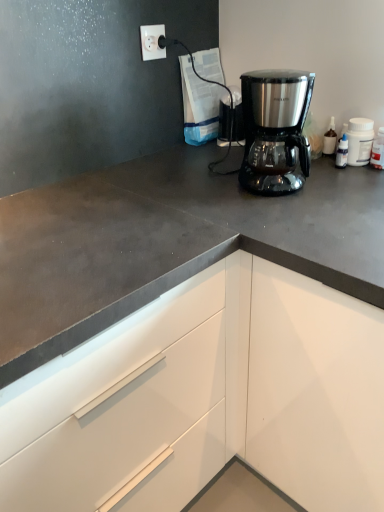
Question: Does white plastic socket at upper left have a larger size compared to stainless steel coffee maker at center?

Choices:
 (A) yes
 (B) no

Answer: (B)

Question: Is white plastic socket at upper left in front of stainless steel coffee maker at center?

Choices:
 (A) no
 (B) yes

Answer: (A)

Question: Is white plastic socket at upper left not inside stainless steel coffee maker at center?

Choices:
 (A) no
 (B) yes

Answer: (B)

Question: Could you tell me if white plastic socket at upper left is facing stainless steel coffee maker at center?

Choices:
 (A) no
 (B) yes

Answer: (B)

Question: Considering the relative sizes of white plastic socket at upper left and stainless steel coffee maker at center in the image provided, is white plastic socket at upper left smaller than stainless steel coffee maker at center?

Choices:
 (A) no
 (B) yes

Answer: (B)

Question: Relative to stainless steel coffee maker at center, is white plastic socket at upper left in front or behind?

Choices:
 (A) front
 (B) behind

Answer: (B)

Question: Is point (157, 29) positioned closer to the camera than point (253, 187)?

Choices:
 (A) closer
 (B) farther

Answer: (B)

Question: From the image's perspective, is white plastic socket at upper left positioned above or below stainless steel coffee maker at center?

Choices:
 (A) above
 (B) below

Answer: (A)

Question: Would you say white plastic socket at upper left is to the left or to the right of stainless steel coffee maker at center in the picture?

Choices:
 (A) left
 (B) right

Answer: (A)

Question: In terms of size, does stainless steel coffee maker at center appear bigger or smaller than white plastic socket at upper left?

Choices:
 (A) big
 (B) small

Answer: (A)

Question: From their relative heights in the image, would you say stainless steel coffee maker at center is taller or shorter than white plastic socket at upper left?

Choices:
 (A) tall
 (B) short

Answer: (A)

Question: Visually, is stainless steel coffee maker at center positioned to the left or to the right of white plastic socket at upper left?

Choices:
 (A) right
 (B) left

Answer: (A)

Question: From the image's perspective, is stainless steel coffee maker at center above or below white plastic socket at upper left?

Choices:
 (A) above
 (B) below

Answer: (B)

Question: From the image's perspective, is white plastic bottle at upper right above or below white plastic socket at upper left?

Choices:
 (A) above
 (B) below

Answer: (B)

Question: From a real-world perspective, is white plastic bottle at upper right above or below white plastic socket at upper left?

Choices:
 (A) below
 (B) above

Answer: (A)